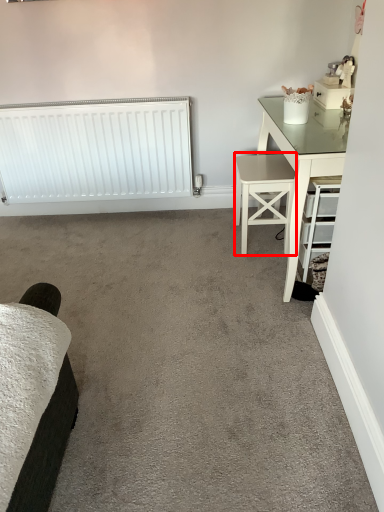
Question: Observing the image, what is the correct spatial positioning of stool (annotated by the red box) in reference to radiator?

Choices:
 (A) left
 (B) right

Answer: (B)